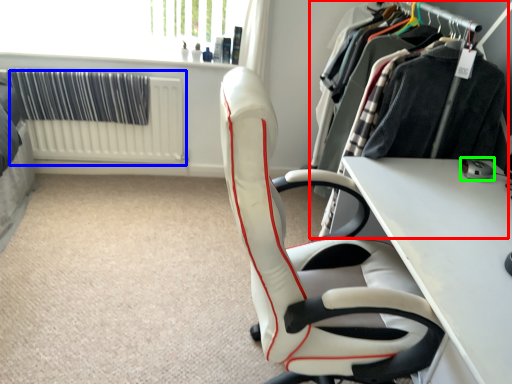
Question: Considering the real-world distances, which object is closest to closet (highlighted by a red box)? radiator (highlighted by a blue box) or equipment (highlighted by a green box).

Choices:
 (A) radiator
 (B) equipment

Answer: (B)